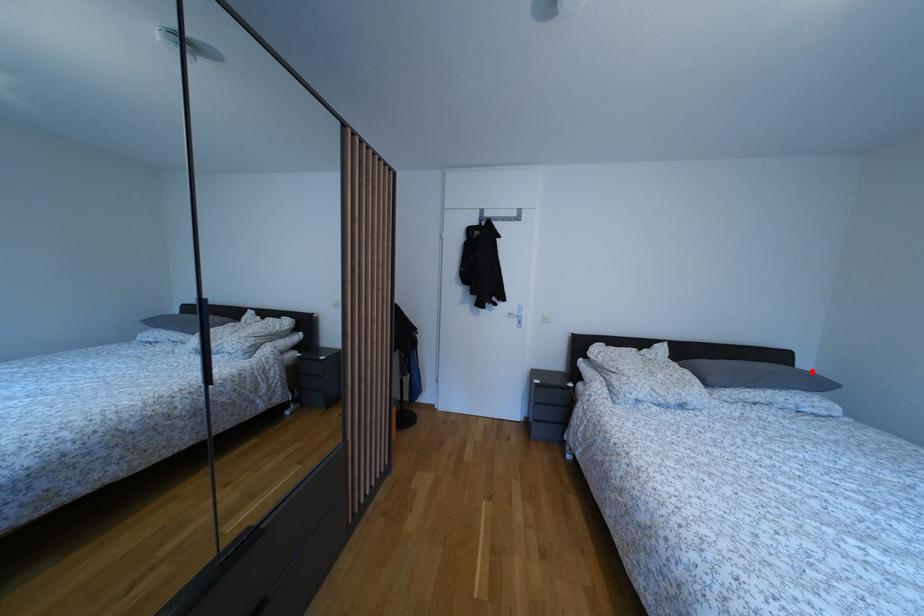
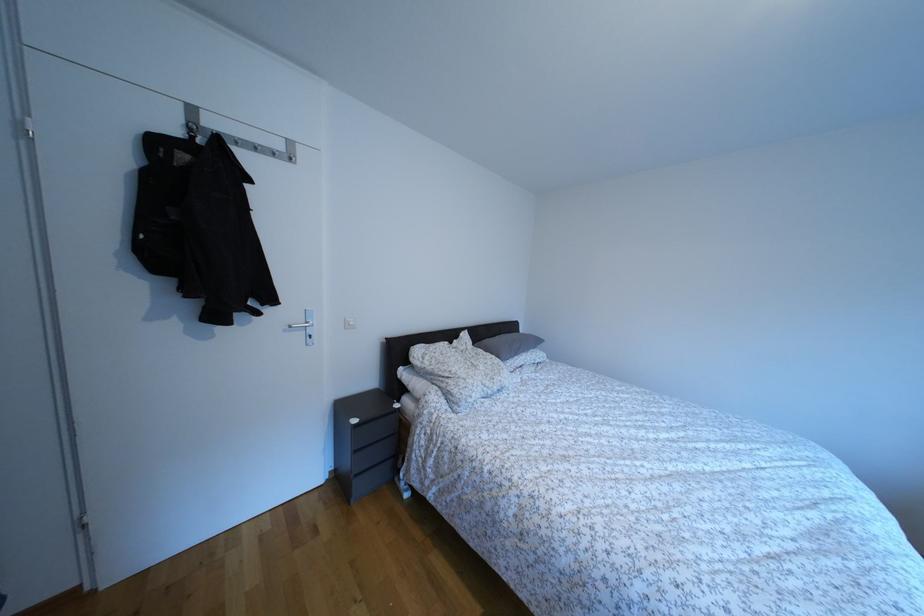
In the second image, find the point that corresponds to the highlighted location in the first image.

(529, 336)